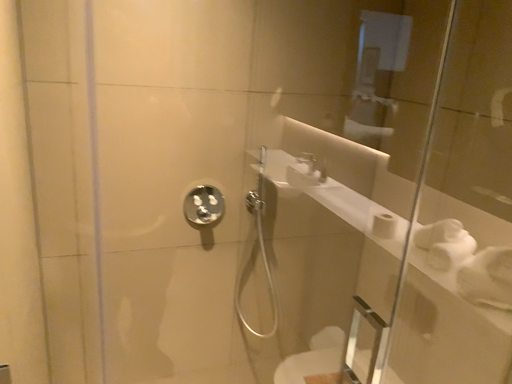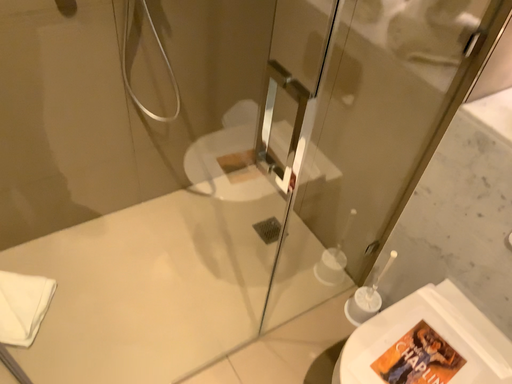
Question: How did the camera likely rotate when shooting the video?

Choices:
 (A) rotated right
 (B) rotated left

Answer: (A)